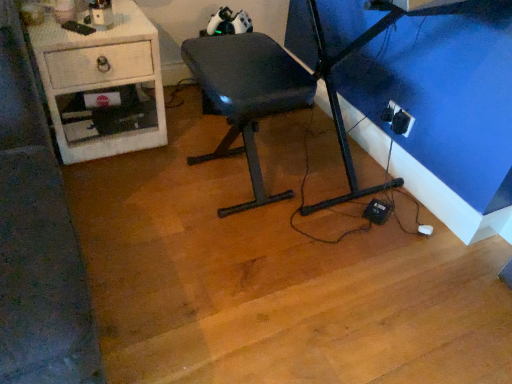
Find the location of `vacant region in front of matte black chair at center`. vacant region in front of matte black chair at center is located at coordinates (218, 256).